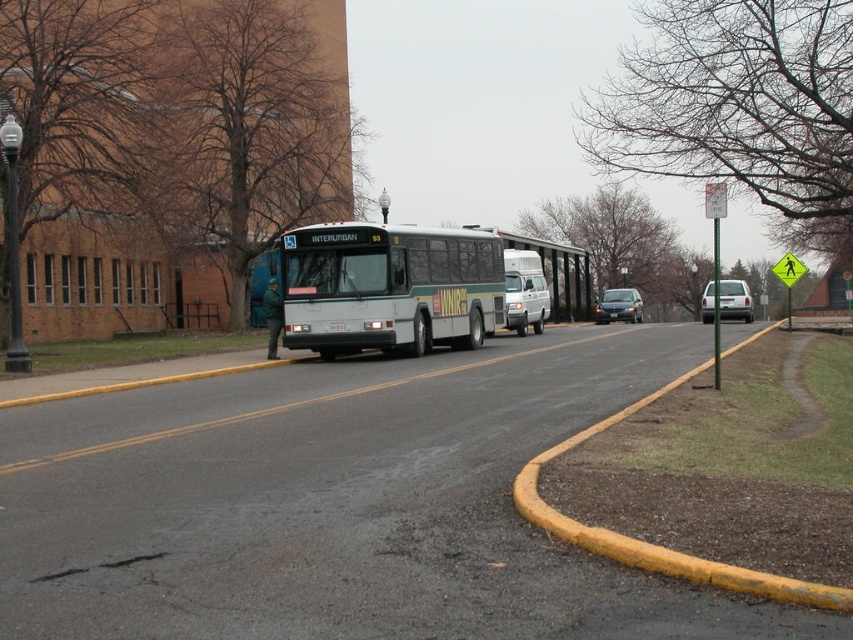
Question: Which object is closer to the camera taking this photo?

Choices:
 (A) silver metallic sedan at right
 (B) green matte bus stop at center

Answer: (A)

Question: Is yellow painted curb at lower right to the left of green matte bus stop at center from the viewer's perspective?

Choices:
 (A) yes
 (B) no

Answer: (A)

Question: Is yellow painted curb at lower right bigger than green matte bus stop at center?

Choices:
 (A) yes
 (B) no

Answer: (B)

Question: Which of these objects is positioned closest to the metallic silver sedan at center?

Choices:
 (A) yellow painted curb at lower right
 (B) silver metallic sedan at right
 (C) white matte van at center
 (D) white matte bus at center

Answer: (B)

Question: Can you confirm if white matte bus at center is bigger than white matte van at center?

Choices:
 (A) yes
 (B) no

Answer: (A)

Question: Which of the following is the farthest from the observer?

Choices:
 (A) metallic silver sedan at center
 (B) silver metallic sedan at right
 (C) white matte van at center
 (D) green matte bus stop at center

Answer: (A)